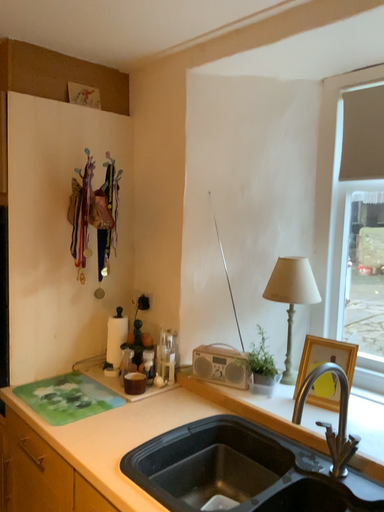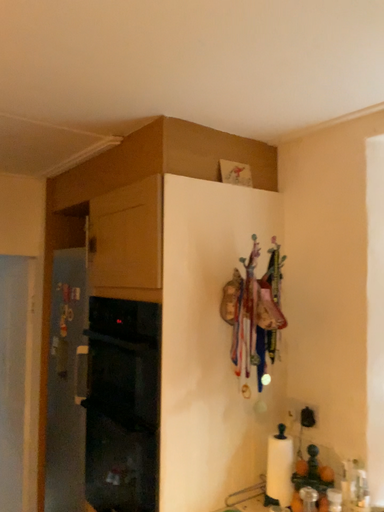
Question: Which way did the camera rotate in the video?

Choices:
 (A) rotated downward
 (B) rotated upward

Answer: (B)